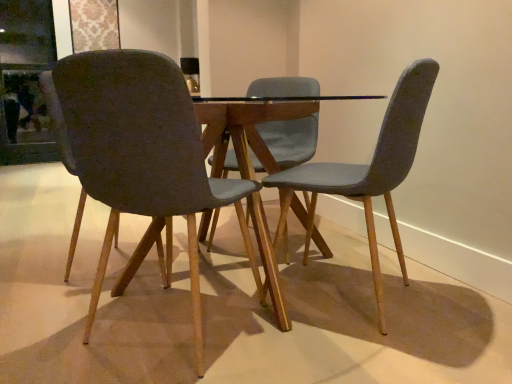
Question: Is transparent glass door at upper left at the right side of textured gray chair at center, the second chair when ordered from left to right?

Choices:
 (A) yes
 (B) no

Answer: (B)

Question: From the image's perspective, is transparent glass door at upper left on top of textured gray chair at center, the second chair when ordered from left to right?

Choices:
 (A) yes
 (B) no

Answer: (A)

Question: Is transparent glass door at upper left to the left of textured gray chair at center, which ranks as the 1th chair in right-to-left order, from the viewer's perspective?

Choices:
 (A) no
 (B) yes

Answer: (B)

Question: Can you confirm if transparent glass door at upper left is shorter than textured gray chair at center, the second chair when ordered from left to right?

Choices:
 (A) yes
 (B) no

Answer: (B)

Question: From a real-world perspective, is transparent glass door at upper left below textured gray chair at center, which ranks as the 1th chair in right-to-left order?

Choices:
 (A) yes
 (B) no

Answer: (B)

Question: Are transparent glass door at upper left and textured gray chair at center, the second chair when ordered from left to right, making contact?

Choices:
 (A) no
 (B) yes

Answer: (A)

Question: Is textured gray chair at left, which is the 2th chair in right-to-left order, touching textured gray chair at center, the second chair when ordered from left to right?

Choices:
 (A) yes
 (B) no

Answer: (B)

Question: Can you confirm if textured gray chair at left, which is the first chair from left to right, is smaller than textured gray chair at center, the second chair when ordered from left to right?

Choices:
 (A) yes
 (B) no

Answer: (A)

Question: Does textured gray chair at left, which is the first chair from left to right, have a greater height compared to textured gray chair at center, the second chair when ordered from left to right?

Choices:
 (A) yes
 (B) no

Answer: (B)

Question: From the image's perspective, is textured gray chair at left, which is the first chair from left to right, over textured gray chair at center, which ranks as the 1th chair in right-to-left order?

Choices:
 (A) yes
 (B) no

Answer: (B)

Question: Can you confirm if textured gray chair at left, which is the first chair from left to right, is wider than textured gray chair at center, which ranks as the 1th chair in right-to-left order?

Choices:
 (A) no
 (B) yes

Answer: (B)

Question: From the image's perspective, is textured gray chair at left, which is the 2th chair in right-to-left order, under textured gray chair at center, which ranks as the 1th chair in right-to-left order?

Choices:
 (A) no
 (B) yes

Answer: (B)

Question: Considering the relative sizes of textured gray chair at left, which is the first chair from left to right, and transparent glass door at upper left in the image provided, is textured gray chair at left, which is the first chair from left to right, shorter than transparent glass door at upper left?

Choices:
 (A) no
 (B) yes

Answer: (B)